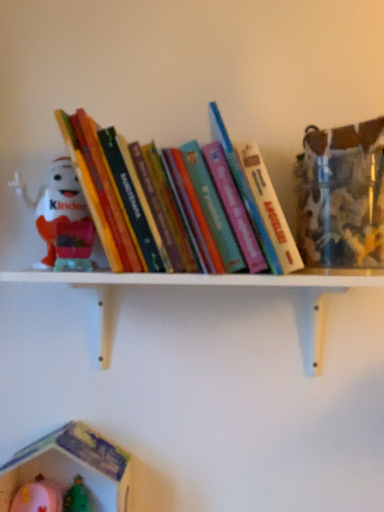
What do you see at coordinates (212, 286) in the screenshot? I see `white wooden shelf at upper center` at bounding box center [212, 286].

This screenshot has height=512, width=384. What do you see at coordinates (233, 207) in the screenshot?
I see `hardcover books at center` at bounding box center [233, 207].

Where is `white wooden shelf at upper center`? Image resolution: width=384 pixels, height=512 pixels. white wooden shelf at upper center is located at coordinates (212, 286).

From the image's perspective, is matte plastic kinder egg at left, positioned as the 2th toy in bottom-to-top order, located above plastic toy house at lower left, marked as the 1th toy in a bottom-to-top arrangement?

Yes, from the image's perspective, matte plastic kinder egg at left, positioned as the 2th toy in bottom-to-top order, is above plastic toy house at lower left, marked as the 1th toy in a bottom-to-top arrangement.

Find the location of `toy located on the right of plastic toy house at lower left, positioned as the 2th toy in top-to-bottom order`. toy located on the right of plastic toy house at lower left, positioned as the 2th toy in top-to-bottom order is located at coordinates (61, 217).

Does matte plastic kinder egg at left, the 1th toy when ordered from top to bottom, touch plastic toy house at lower left, positioned as the 2th toy in top-to-bottom order?

No, matte plastic kinder egg at left, the 1th toy when ordered from top to bottom, is not touching plastic toy house at lower left, positioned as the 2th toy in top-to-bottom order.

Which object is wider, matte plastic kinder egg at left, the 1th toy when ordered from top to bottom, or plastic toy house at lower left, positioned as the 2th toy in top-to-bottom order?

With larger width is plastic toy house at lower left, positioned as the 2th toy in top-to-bottom order.

Does hardcover books at center have a larger size compared to white wooden shelf at upper center?

Incorrect, hardcover books at center is not larger than white wooden shelf at upper center.

Is hardcover books at center aimed at white wooden shelf at upper center?

No, hardcover books at center does not turn towards white wooden shelf at upper center.

What's the angular difference between hardcover books at center and white wooden shelf at upper center's facing directions?

The facing directions of hardcover books at center and white wooden shelf at upper center are 0.000322 degrees apart.

Is hardcover books at center wider or thinner than white wooden shelf at upper center?

In the image, hardcover books at center appears to be wider than white wooden shelf at upper center.

Considering the points (72, 203) and (320, 335), which point is in front, point (72, 203) or point (320, 335)?

The point (72, 203) is closer.

From a real-world perspective, relative to white wooden shelf at upper center, is matte plastic kinder egg at left, the 1th toy when ordered from top to bottom, vertically above or below?

matte plastic kinder egg at left, the 1th toy when ordered from top to bottom, is above white wooden shelf at upper center.

Are matte plastic kinder egg at left, the 1th toy when ordered from top to bottom, and white wooden shelf at upper center located far from each other?

They are positioned close to each other.

Where is `book above the white wooden shelf at upper center (from the image's perspective)`? The image size is (384, 512). book above the white wooden shelf at upper center (from the image's perspective) is located at coordinates (233, 207).

Is white wooden shelf at upper center not close to hardcover books at center?

Actually, white wooden shelf at upper center and hardcover books at center are a little close together.

Can you confirm if white wooden shelf at upper center is wider than hardcover books at center?

Incorrect, the width of white wooden shelf at upper center does not surpass that of hardcover books at center.

From the image's perspective, is white wooden shelf at upper center beneath hardcover books at center?

Correct, white wooden shelf at upper center appears lower than hardcover books at center in the image.

Considering the points (250, 225) and (47, 193), which point is in front, point (250, 225) or point (47, 193)?

Positioned in front is point (250, 225).

Which of these two, hardcover books at center or matte plastic kinder egg at left, the 1th toy when ordered from top to bottom, is bigger?

Bigger between the two is hardcover books at center.

Can you confirm if hardcover books at center is wider than matte plastic kinder egg at left, positioned as the 2th toy in bottom-to-top order?

Yes, hardcover books at center is wider than matte plastic kinder egg at left, positioned as the 2th toy in bottom-to-top order.

From a real-world perspective, is hardcover books at center beneath matte plastic kinder egg at left, the 1th toy when ordered from top to bottom?

No, from a real-world perspective, hardcover books at center is not under matte plastic kinder egg at left, the 1th toy when ordered from top to bottom.

Is white wooden shelf at upper center next to matte plastic kinder egg at left, the 1th toy when ordered from top to bottom, and touching it?

No, white wooden shelf at upper center is not next to matte plastic kinder egg at left, the 1th toy when ordered from top to bottom.

Is white wooden shelf at upper center bigger than matte plastic kinder egg at left, positioned as the 2th toy in bottom-to-top order?

Indeed, white wooden shelf at upper center has a larger size compared to matte plastic kinder egg at left, positioned as the 2th toy in bottom-to-top order.

Which is in front, white wooden shelf at upper center or matte plastic kinder egg at left, the 1th toy when ordered from top to bottom?

white wooden shelf at upper center is more forward.

From the image's perspective, does white wooden shelf at upper center appear lower than matte plastic kinder egg at left, positioned as the 2th toy in bottom-to-top order?

Yes, from the image's perspective, white wooden shelf at upper center is beneath matte plastic kinder egg at left, positioned as the 2th toy in bottom-to-top order.

Is white wooden shelf at upper center positioned behind plastic toy house at lower left, positioned as the 2th toy in top-to-bottom order?

No.

Is white wooden shelf at upper center far away from plastic toy house at lower left, positioned as the 2th toy in top-to-bottom order?

No, there isn't a large distance between white wooden shelf at upper center and plastic toy house at lower left, positioned as the 2th toy in top-to-bottom order.

How distant is white wooden shelf at upper center from plastic toy house at lower left, positioned as the 2th toy in top-to-bottom order?

white wooden shelf at upper center and plastic toy house at lower left, positioned as the 2th toy in top-to-bottom order, are 10.60 inches apart from each other.

Is white wooden shelf at upper center positioned beyond the bounds of plastic toy house at lower left, positioned as the 2th toy in top-to-bottom order?

That's correct, white wooden shelf at upper center is outside of plastic toy house at lower left, positioned as the 2th toy in top-to-bottom order.

The image size is (384, 512). Identify the location of toy on the right of the plastic toy house at lower left, marked as the 1th toy in a bottom-to-top arrangement. (61, 217).

Identify the location of shelf located below the hardcover books at center (from the image's perspective). The image size is (384, 512). (212, 286).

From the image, which object appears to be farther from hardcover books at center, matte plastic kinder egg at left, positioned as the 2th toy in bottom-to-top order, or white wooden shelf at upper center?

matte plastic kinder egg at left, positioned as the 2th toy in bottom-to-top order.

Looking at the image, which one is located further to hardcover books at center, white wooden shelf at upper center or plastic toy house at lower left, positioned as the 2th toy in top-to-bottom order?

plastic toy house at lower left, positioned as the 2th toy in top-to-bottom order.

Estimate the real-world distances between objects in this image. Which object is further from white wooden shelf at upper center, matte plastic kinder egg at left, positioned as the 2th toy in bottom-to-top order, or plastic toy house at lower left, marked as the 1th toy in a bottom-to-top arrangement?

plastic toy house at lower left, marked as the 1th toy in a bottom-to-top arrangement, lies further to white wooden shelf at upper center than the other object.

Considering their positions, is hardcover books at center positioned closer to matte plastic kinder egg at left, the 1th toy when ordered from top to bottom, than white wooden shelf at upper center?

hardcover books at center.

When comparing their distances from white wooden shelf at upper center, does plastic toy house at lower left, positioned as the 2th toy in top-to-bottom order, or hardcover books at center seem further?

Based on the image, plastic toy house at lower left, positioned as the 2th toy in top-to-bottom order, appears to be further to white wooden shelf at upper center.

Looking at the image, which one is located closer to matte plastic kinder egg at left, the 1th toy when ordered from top to bottom, plastic toy house at lower left, positioned as the 2th toy in top-to-bottom order, or hardcover books at center?

The object closer to matte plastic kinder egg at left, the 1th toy when ordered from top to bottom, is hardcover books at center.

In the scene shown: When comparing their distances from plastic toy house at lower left, marked as the 1th toy in a bottom-to-top arrangement, does white wooden shelf at upper center or hardcover books at center seem further?

Among the two, hardcover books at center is located further to plastic toy house at lower left, marked as the 1th toy in a bottom-to-top arrangement.

Looking at the image, which one is located further to white wooden shelf at upper center, hardcover books at center or matte plastic kinder egg at left, positioned as the 2th toy in bottom-to-top order?

matte plastic kinder egg at left, positioned as the 2th toy in bottom-to-top order.

Where is `book between matte plastic kinder egg at left, positioned as the 2th toy in bottom-to-top order, and white wooden shelf at upper center, in the horizontal direction`? book between matte plastic kinder egg at left, positioned as the 2th toy in bottom-to-top order, and white wooden shelf at upper center, in the horizontal direction is located at coordinates (233, 207).

This screenshot has height=512, width=384. I want to click on shelf between hardcover books at center and plastic toy house at lower left, marked as the 1th toy in a bottom-to-top arrangement, vertically, so click(x=212, y=286).

Where is `toy between hardcover books at center and plastic toy house at lower left, marked as the 1th toy in a bottom-to-top arrangement, in the vertical direction`? toy between hardcover books at center and plastic toy house at lower left, marked as the 1th toy in a bottom-to-top arrangement, in the vertical direction is located at coordinates (61, 217).

Locate an element on the screen. The height and width of the screenshot is (512, 384). shelf that lies between matte plastic kinder egg at left, positioned as the 2th toy in bottom-to-top order, and plastic toy house at lower left, positioned as the 2th toy in top-to-bottom order, from top to bottom is located at coordinates (212, 286).